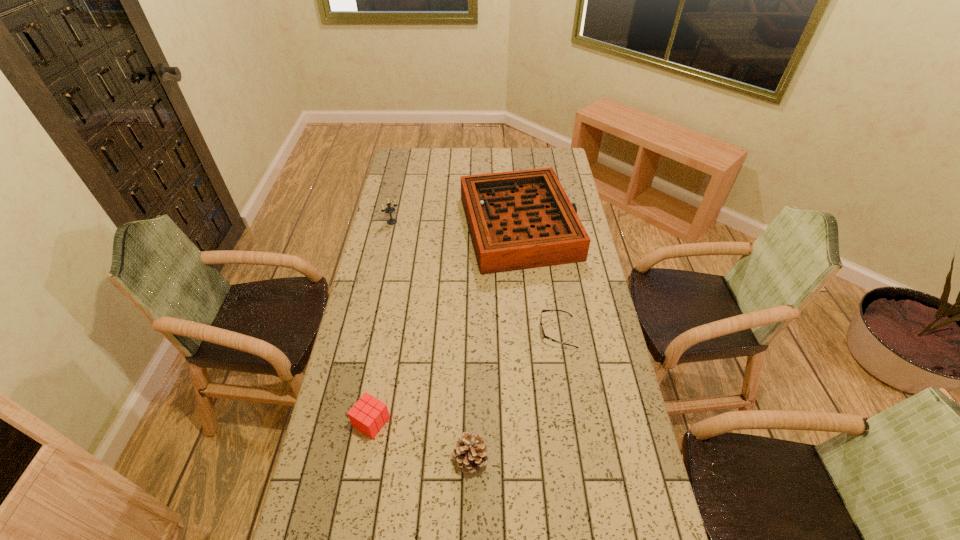
In order to click on candle holder in this screenshot , I will do `click(388, 210)`.

Locate an element on the screen. gameboard is located at coordinates (523, 219).

Image resolution: width=960 pixels, height=540 pixels. I want to click on pinecone, so click(470, 453).

The image size is (960, 540). I want to click on cube, so click(368, 415).

Locate an element on the screen. The image size is (960, 540). the fourth tallest object is located at coordinates (368, 415).

Identify the location of the third nearest object. The height and width of the screenshot is (540, 960). 543,335.

Locate an element on the screen. Image resolution: width=960 pixels, height=540 pixels. sunglasses is located at coordinates [x=543, y=335].

Find the location of `vacant space located 0.230m on the right of the candle holder`. vacant space located 0.230m on the right of the candle holder is located at coordinates (450, 222).

Identify the location of vacant space located 0.080m on the back of the gameboard. This screenshot has height=540, width=960. (514, 179).

This screenshot has height=540, width=960. Find the location of `free space located 0.250m on the right of the nearest object`. free space located 0.250m on the right of the nearest object is located at coordinates (577, 458).